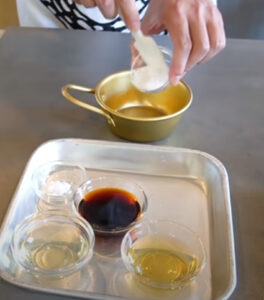
You are a GUI agent. You are given a task and a screenshot of the screen. Output one action in this format:
    pyautogui.click(x=<x>, y=<y>)
    Task: Click on the whisk to stir
    
    Given the screenshot: What is the action you would take?
    pyautogui.click(x=140, y=37)